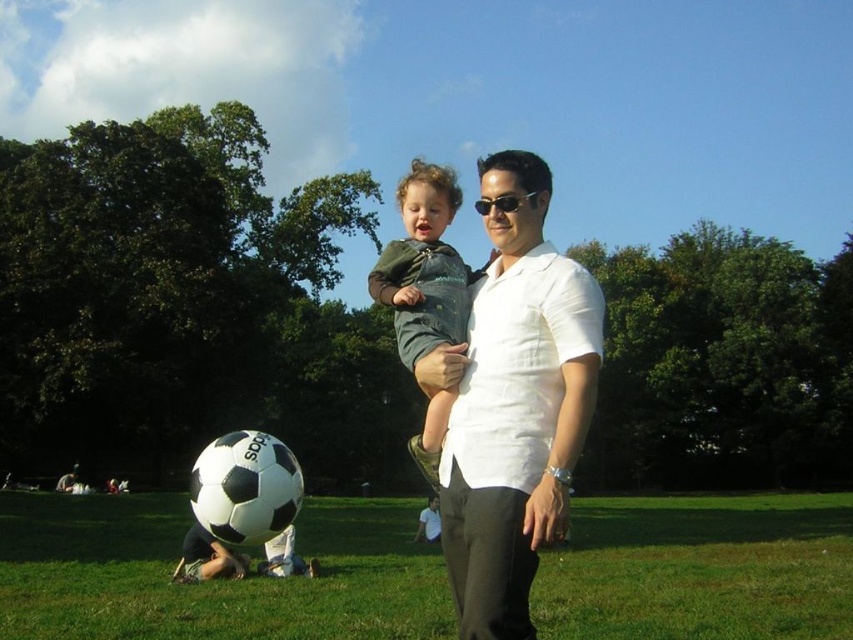
In the scene shown: Does green grass at lower center appear on the right side of white linen shirt at center?

Correct, you'll find green grass at lower center to the right of white linen shirt at center.

Is point (828, 570) positioned before point (547, 403)?

No, it is behind (547, 403).

Between point (53, 621) and point (529, 564), which one is positioned behind?

Positioned behind is point (53, 621).

The image size is (853, 640). I want to click on green grass at lower center, so click(x=212, y=582).

Is point (444, 544) positioned behind point (437, 234)?

No, (444, 544) is in front of (437, 234).

Between white linen shirt at center and green denim overalls at center, which one appears on the left side from the viewer's perspective?

Positioned to the left is green denim overalls at center.

Is point (556, 264) positioned after point (492, 253)?

That is False.

You are a GUI agent. You are given a task and a screenshot of the screen. Output one action in this format:
    pyautogui.click(x=<x>, y=<y>)
    Task: Click on the white linen shirt at center
    The width and height of the screenshot is (853, 640).
    Given the screenshot: What is the action you would take?
    pyautogui.click(x=515, y=404)

Is green grass at lower center to the right of green denim overalls at center from the viewer's perspective?

Correct, you'll find green grass at lower center to the right of green denim overalls at center.

Which is above, green grass at lower center or green denim overalls at center?

green denim overalls at center is above.

Locate an element on the screen. This screenshot has height=640, width=853. green grass at lower center is located at coordinates (212, 582).